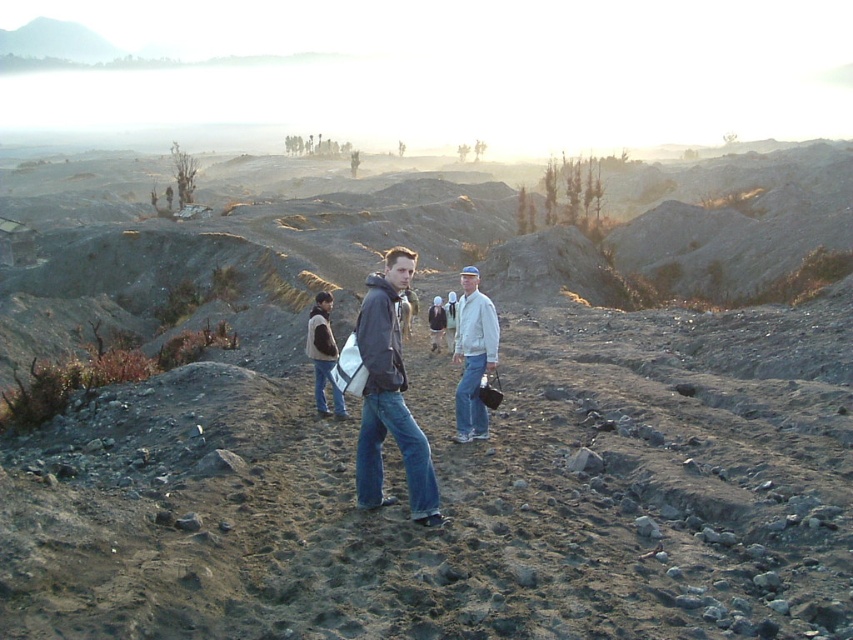
You are standing at the point labeled point (436, 330) and want to walk towards the point labeled point (473, 330). Given the rugged terrain described, will you have to walk uphill or downhill?

Since point (473, 330) is in front of point (436, 330), you will have to walk uphill to reach it.

You are a photographer trying to capture a group shot of the people in the rugged landscape. You notice the white matte jacket at center and the brown suede vest at center. Which clothing item will appear wider in the photo?

The white matte jacket at center will appear wider in the photo since its width is larger than that of the brown suede vest at center.

You are a photographer trying to capture a clear shot of both the white matte jacket at center and the brown suede vest at center. Since they are both at the center, which one do you think will be more visible in your photo?

The white matte jacket at center is bigger than the brown suede vest at center, so it will be more visible in the photo.